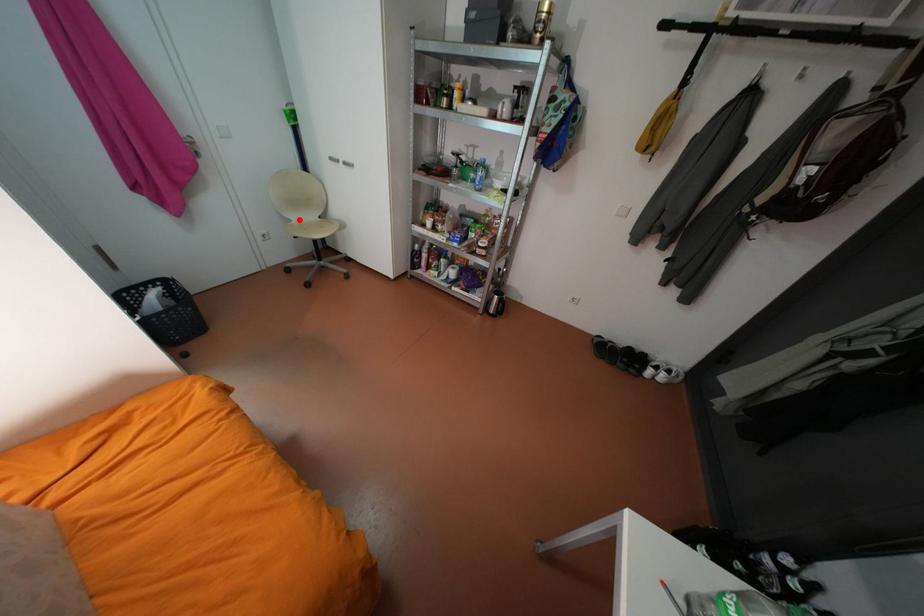
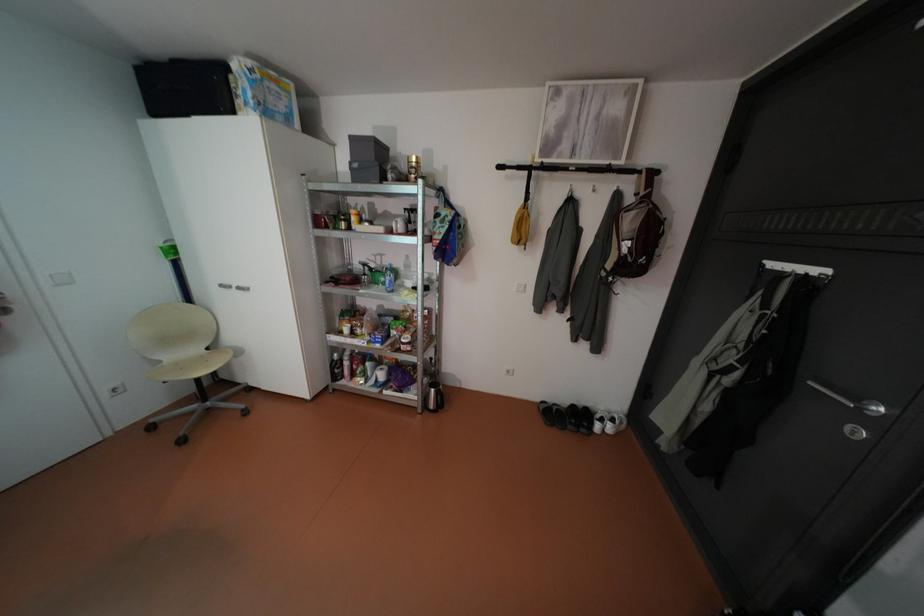
Find the pixel in the second image that matches the highlighted location in the first image.

(168, 361)